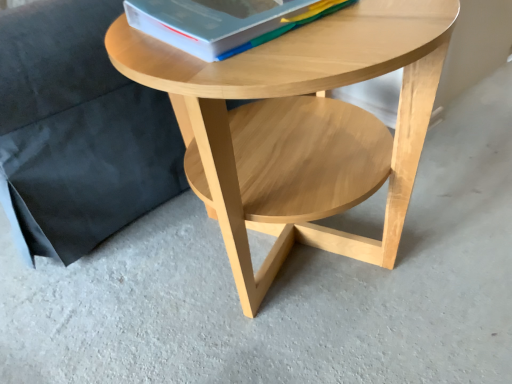
Question: Considering the positions of matte wood armchair at upper left and natural wood coffee table at center in the image, is matte wood armchair at upper left taller or shorter than natural wood coffee table at center?

Choices:
 (A) tall
 (B) short

Answer: (A)

Question: In terms of width, does matte wood armchair at upper left look wider or thinner when compared to natural wood coffee table at center?

Choices:
 (A) thin
 (B) wide

Answer: (B)

Question: Which object is the closest to the natural wood coffee table at center?

Choices:
 (A) matte wood armchair at upper left
 (B) hardcover book at upper center

Answer: (B)

Question: Which is nearer to the natural wood coffee table at center?

Choices:
 (A) hardcover book at upper center
 (B) matte wood armchair at upper left

Answer: (A)